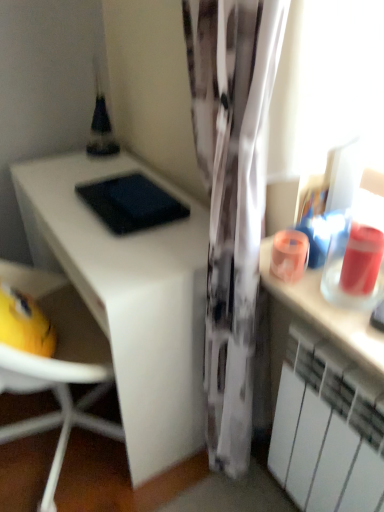
Question: From a real-world perspective, is white matte radiator at lower right positioned under white matte desk at left based on gravity?

Choices:
 (A) no
 (B) yes

Answer: (A)

Question: From the image's perspective, is white matte radiator at lower right located above white matte desk at left?

Choices:
 (A) yes
 (B) no

Answer: (B)

Question: Is white matte desk at left completely or partially inside white matte radiator at lower right?

Choices:
 (A) no
 (B) yes

Answer: (A)

Question: Is white matte desk at left at the back of white matte radiator at lower right?

Choices:
 (A) yes
 (B) no

Answer: (B)

Question: Considering the relative sizes of white matte radiator at lower right and white matte desk at left in the image provided, is white matte radiator at lower right thinner than white matte desk at left?

Choices:
 (A) no
 (B) yes

Answer: (B)

Question: Would you say white matte radiator at lower right is a long distance from white matte desk at left?

Choices:
 (A) yes
 (B) no

Answer: (B)

Question: From the image's perspective, is white matte desk at left over white matte radiator at lower right?

Choices:
 (A) yes
 (B) no

Answer: (A)

Question: From a real-world perspective, is white matte desk at left positioned under white matte radiator at lower right based on gravity?

Choices:
 (A) no
 (B) yes

Answer: (B)

Question: Could you tell me if white matte desk at left is facing white matte radiator at lower right?

Choices:
 (A) yes
 (B) no

Answer: (B)

Question: Does white matte desk at left lie behind white matte radiator at lower right?

Choices:
 (A) no
 (B) yes

Answer: (B)

Question: Is white matte desk at left positioned before white matte radiator at lower right?

Choices:
 (A) no
 (B) yes

Answer: (A)

Question: Considering the relative sizes of white matte desk at left and white matte radiator at lower right in the image provided, is white matte desk at left thinner than white matte radiator at lower right?

Choices:
 (A) yes
 (B) no

Answer: (B)

Question: Considering the positions of point (114, 314) and point (311, 334), is point (114, 314) closer or farther from the camera than point (311, 334)?

Choices:
 (A) farther
 (B) closer

Answer: (A)